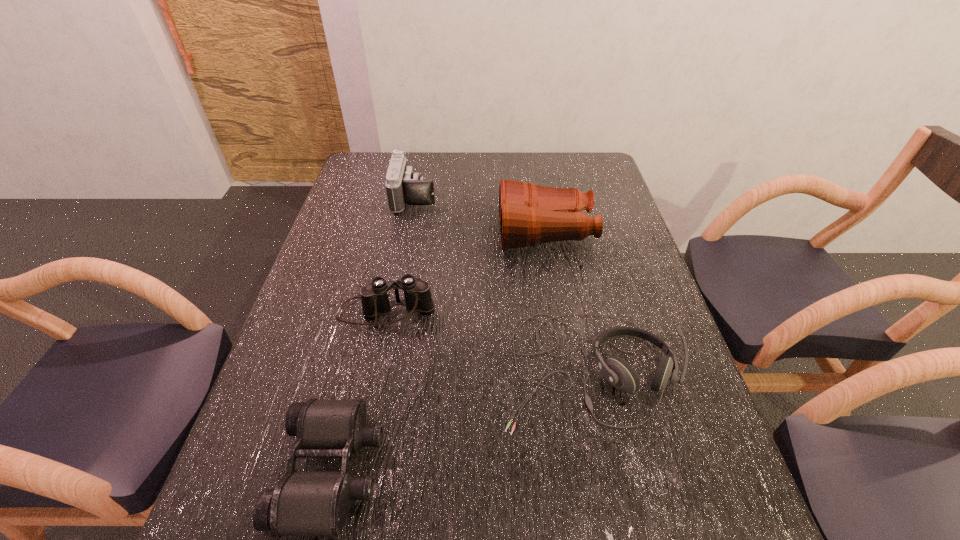
Find the location of a particular element. The width and height of the screenshot is (960, 540). the tallest binoculars is located at coordinates (529, 214).

Find the location of a particular element. This screenshot has width=960, height=540. the farthest binoculars is located at coordinates (529, 214).

Locate an element on the screen. This screenshot has width=960, height=540. camera is located at coordinates (403, 185).

This screenshot has height=540, width=960. What are the coordinates of `the second shortest binoculars` in the screenshot? It's located at (374, 297).

The height and width of the screenshot is (540, 960). What are the coordinates of `headset` in the screenshot? It's located at (617, 371).

Locate an element on the screen. The image size is (960, 540). vacant space located through the lenses of the tallest binoculars is located at coordinates (372, 232).

The height and width of the screenshot is (540, 960). I want to click on free point located 0.150m through the lenses of the tallest binoculars, so click(x=451, y=232).

The width and height of the screenshot is (960, 540). I want to click on free space located 0.090m through the lenses of the tallest binoculars, so click(x=470, y=232).

Find the location of a particular element. This screenshot has height=540, width=960. free spot located 0.280m at the front of the camera with an open lens cover is located at coordinates (520, 197).

You are a GUI agent. You are given a task and a screenshot of the screen. Output one action in this format:
    pyautogui.click(x=<x>, y=<y>)
    Task: Click on the vacant space positioned on the back of the second farthest binoculars
    
    Given the screenshot: What is the action you would take?
    pyautogui.click(x=408, y=207)